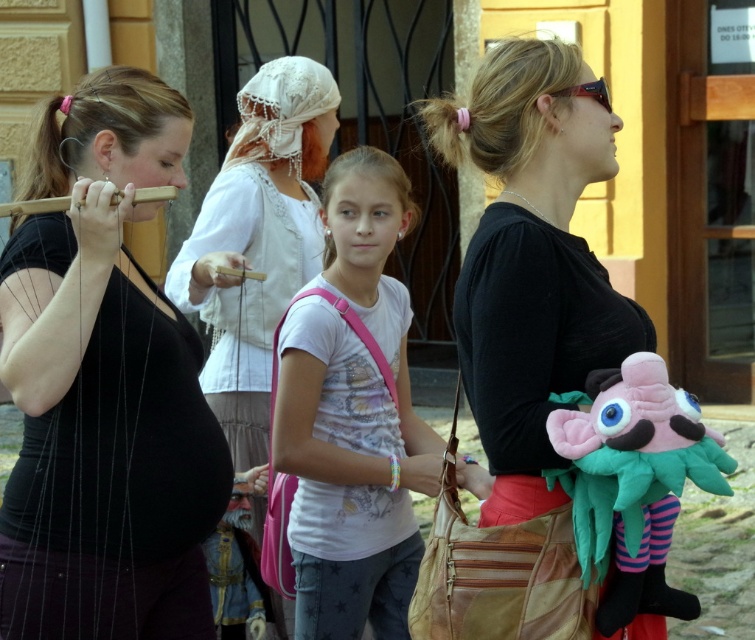
Question: Estimate the real-world distances between objects in this image. Which object is farther from the black matte shirt at left?

Choices:
 (A) pink plush toy at right
 (B) wooden flute at left
 (C) white lace headscarf at center
 (D) wooden flute at center

Answer: (A)

Question: Is white printed t-shirt at center thinner than wooden flute at left?

Choices:
 (A) yes
 (B) no

Answer: (B)

Question: Which is nearer to the wooden flute at center?

Choices:
 (A) matte black plush toy at center
 (B) white printed t-shirt at center
 (C) wooden flute at left

Answer: (B)

Question: Can you confirm if white lace headscarf at center is thinner than wooden flute at left?

Choices:
 (A) yes
 (B) no

Answer: (B)

Question: Does black matte shirt at left appear on the right side of pink plush toy at right?

Choices:
 (A) yes
 (B) no

Answer: (B)

Question: Among these points, which one is farthest from the camera?

Choices:
 (A) pos(618,451)
 (B) pos(559,486)
 (C) pos(293,358)
 (D) pos(233,275)

Answer: (D)